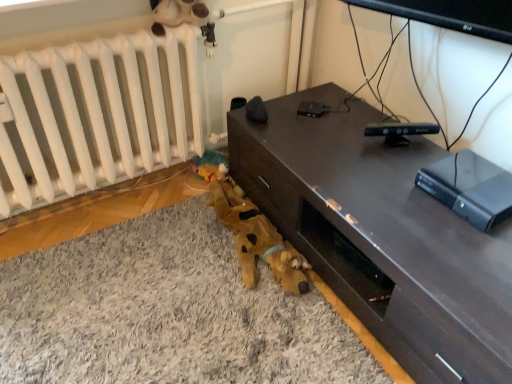
Find the location of `dark wood desk at center`. dark wood desk at center is located at coordinates (382, 236).

Locate an element on the screen. This screenshot has width=512, height=384. brown plush toy at lower left is located at coordinates (166, 313).

What do you see at coordinates (96, 115) in the screenshot? The height and width of the screenshot is (384, 512). I see `white matte radiator at lower left` at bounding box center [96, 115].

This screenshot has height=384, width=512. Find the location of `white matte radiator at lower left`. white matte radiator at lower left is located at coordinates (96, 115).

The width and height of the screenshot is (512, 384). Find the location of `black plastic remote control at upper center, arranged as the 2th gadget when viewed from the left`. black plastic remote control at upper center, arranged as the 2th gadget when viewed from the left is located at coordinates (399, 131).

Based on their positions, is black plastic gaming console at right located to the left or right of white matte radiator at lower left?

black plastic gaming console at right is positioned on white matte radiator at lower left's right side.

Is white matte radiator at lower left inside black plastic gaming console at right?

No, white matte radiator at lower left is not inside black plastic gaming console at right.

In the scene shown: Does black plastic gaming console at right come in front of white matte radiator at lower left?

That is True.

Between black plastic gaming console at right and white matte radiator at lower left, which one has larger width?

Wider between the two is black plastic gaming console at right.

Could you measure the distance between brown plush toy at lower left and black plastic remote control at center, placed as the 1th gadget when sorted from back to front?

brown plush toy at lower left is 37.11 inches away from black plastic remote control at center, placed as the 1th gadget when sorted from back to front.

From a real-world perspective, which is physically below, brown plush toy at lower left or black plastic remote control at center, marked as the 1th gadget in a left-to-right arrangement?

From a 3D spatial view, brown plush toy at lower left is below.

Is brown plush toy at lower left surrounding black plastic remote control at center, the 1th gadget positioned from the top?

No, black plastic remote control at center, the 1th gadget positioned from the top, is not a part of brown plush toy at lower left.

From a real-world perspective, is white matte radiator at lower left above or below black plastic gaming console at right?

white matte radiator at lower left is situated higher than black plastic gaming console at right in the real world.

Identify the location of equipment in front of the white matte radiator at lower left. tap(470, 188).

Is point (75, 124) positioned after point (485, 173)?

Yes, point (75, 124) is behind point (485, 173).

Can you tell me how much white matte radiator at lower left and black plastic remote control at upper center, which ranks as the first gadget in front-to-back order, differ in facing direction?

25.5 degrees separate the facing orientations of white matte radiator at lower left and black plastic remote control at upper center, which ranks as the first gadget in front-to-back order.

From a real-world perspective, is white matte radiator at lower left below black plastic remote control at upper center, arranged as the 2th gadget when viewed from the left?

Correct, in the physical world, white matte radiator at lower left is lower than black plastic remote control at upper center, arranged as the 2th gadget when viewed from the left.

Could you tell me if white matte radiator at lower left is facing black plastic remote control at upper center, arranged as the 2th gadget when viewed from the left?

No, white matte radiator at lower left is not turned towards black plastic remote control at upper center, arranged as the 2th gadget when viewed from the left.

Which object is closer to the camera taking this photo, white matte radiator at lower left or black plastic remote control at upper center, which ranks as the first gadget in front-to-back order?

white matte radiator at lower left is more forward.

Is black plastic remote control at center, placed as the 1th gadget when sorted from back to front, aimed at dark wood desk at center?

No.

From the picture: From a real-world perspective, is black plastic remote control at center, marked as the 1th gadget in a left-to-right arrangement, on dark wood desk at center?

Yes.

From the image's perspective, does black plastic remote control at center, the second gadget positioned from the front, appear lower than dark wood desk at center?

Actually, black plastic remote control at center, the second gadget positioned from the front, appears above dark wood desk at center in the image.

At what (x,y) coordinates should I click in order to perform the action: click on desk below the black plastic remote control at center, the second gadget positioned from the front (from the image's perspective). Please return your answer as a coordinate pair (x, y). The image size is (512, 384). Looking at the image, I should click on (382, 236).

From the image's perspective, is black plastic remote control at center, marked as the 1th gadget in a left-to-right arrangement, located beneath white matte radiator at lower left?

No, from the image's perspective, black plastic remote control at center, marked as the 1th gadget in a left-to-right arrangement, is not beneath white matte radiator at lower left.

Considering the sizes of objects black plastic remote control at center, placed as the 1th gadget when sorted from back to front, and white matte radiator at lower left in the image provided, who is smaller, black plastic remote control at center, placed as the 1th gadget when sorted from back to front, or white matte radiator at lower left?

black plastic remote control at center, placed as the 1th gadget when sorted from back to front.

Where is `radiator below the black plastic remote control at center, positioned as the second gadget in bottom-to-top order (from the image's perspective)`? This screenshot has height=384, width=512. radiator below the black plastic remote control at center, positioned as the second gadget in bottom-to-top order (from the image's perspective) is located at coordinates (96, 115).

Is brown plush toy at lower left positioned behind white matte radiator at lower left?

That is False.

Who is shorter, brown plush toy at lower left or white matte radiator at lower left?

With less height is brown plush toy at lower left.

Consider the image. Could you tell me if brown plush toy at lower left is turned towards white matte radiator at lower left?

No, brown plush toy at lower left is not turned towards white matte radiator at lower left.

Where is `plain beneath the white matte radiator at lower left (from a real-world perspective)`? plain beneath the white matte radiator at lower left (from a real-world perspective) is located at coordinates (166, 313).

At what (x,y) coordinates should I click in order to perform the action: click on radiator above the black plastic gaming console at right (from a real-world perspective). Please return your answer as a coordinate pair (x, y). Image resolution: width=512 pixels, height=384 pixels. Looking at the image, I should click on (96, 115).

Locate an element on the screen. Image resolution: width=512 pixels, height=384 pixels. plain below the black plastic remote control at center, marked as the 1th gadget in a left-to-right arrangement (from the image's perspective) is located at coordinates (166, 313).

When comparing their distances from white matte radiator at lower left, does black plastic remote control at center, acting as the second gadget starting from the right, or black plastic gaming console at right seem closer?

black plastic remote control at center, acting as the second gadget starting from the right.

When comparing their distances from black plastic remote control at center, the 1th gadget positioned from the top, does white matte radiator at lower left or black plastic remote control at upper center, marked as the first gadget in a right-to-left arrangement, seem closer?

A: Based on the image, black plastic remote control at upper center, marked as the first gadget in a right-to-left arrangement, appears to be nearer to black plastic remote control at center, the 1th gadget positioned from the top.

Which object lies nearer to the anchor point black plastic remote control at upper center, which ranks as the first gadget in front-to-back order, white matte radiator at lower left or black plastic remote control at center, placed as the 1th gadget when sorted from back to front?

black plastic remote control at center, placed as the 1th gadget when sorted from back to front, lies closer to black plastic remote control at upper center, which ranks as the first gadget in front-to-back order, than the other object.

Which object lies further to the anchor point black plastic remote control at center, the second gadget positioned from the front, dark wood desk at center or black plastic gaming console at right?

Based on the image, black plastic gaming console at right appears to be further to black plastic remote control at center, the second gadget positioned from the front.

From the image, which object appears to be farther from black plastic gaming console at right, dark wood desk at center or brown plush toy at lower left?

brown plush toy at lower left is positioned further to the anchor black plastic gaming console at right.

Which object lies further to the anchor point brown plush toy at lower left, black plastic remote control at upper center, acting as the 1th gadget starting from the bottom, or dark wood desk at center?

black plastic remote control at upper center, acting as the 1th gadget starting from the bottom, lies further to brown plush toy at lower left than the other object.

Based on the photo, when comparing their distances from dark wood desk at center, does black plastic gaming console at right or black plastic remote control at center, positioned as the second gadget in bottom-to-top order, seem further?

black plastic remote control at center, positioned as the second gadget in bottom-to-top order, is positioned further to the anchor dark wood desk at center.

Considering their positions, is brown plush toy at lower left positioned closer to white matte radiator at lower left than black plastic remote control at center, positioned as the second gadget in bottom-to-top order?

Among the two, brown plush toy at lower left is located nearer to white matte radiator at lower left.

What are the coordinates of `equipment located between dark wood desk at center and black plastic remote control at center, positioned as the second gadget in bottom-to-top order, in the depth direction` in the screenshot? It's located at (470, 188).

You are a GUI agent. You are given a task and a screenshot of the screen. Output one action in this format:
    pyautogui.click(x=<x>, y=<y>)
    Task: Click on the radiator between brown plush toy at lower left and black plastic remote control at center, positioned as the second gadget in bottom-to-top order, from front to back
    Image resolution: width=512 pixels, height=384 pixels.
    Given the screenshot: What is the action you would take?
    pyautogui.click(x=96, y=115)

You are a GUI agent. You are given a task and a screenshot of the screen. Output one action in this format:
    pyautogui.click(x=<x>, y=<y>)
    Task: Click on the plain between white matte radiator at lower left and dark wood desk at center in the horizontal direction
    Image resolution: width=512 pixels, height=384 pixels.
    Given the screenshot: What is the action you would take?
    pyautogui.click(x=166, y=313)

The height and width of the screenshot is (384, 512). What are the coordinates of `gadget positioned between brown plush toy at lower left and black plastic remote control at center, the 1th gadget positioned from the top, from near to far` in the screenshot? It's located at (399, 131).